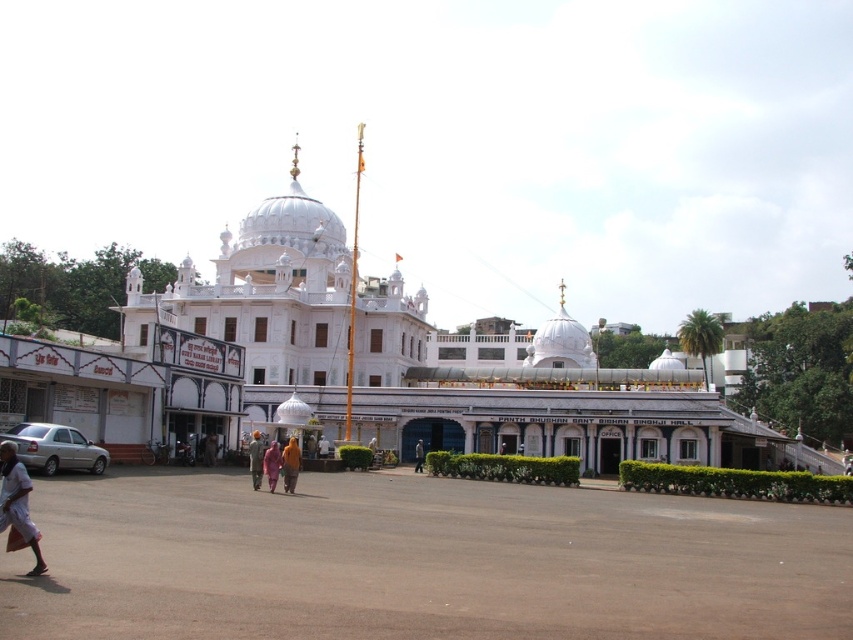
Which is behind, point (291, 488) or point (265, 461)?

The point (265, 461) is behind.

Which of these two, light pink fabric at center or orange fabric person at center, stands taller?

orange fabric person at center is taller.

What do you see at coordinates (289, 465) in the screenshot? I see `light pink fabric at center` at bounding box center [289, 465].

You are a GUI agent. You are given a task and a screenshot of the screen. Output one action in this format:
    pyautogui.click(x=<x>, y=<y>)
    Task: Click on the light pink fabric at center
    This screenshot has width=853, height=640.
    Given the screenshot: What is the action you would take?
    pyautogui.click(x=289, y=465)

The height and width of the screenshot is (640, 853). What do you see at coordinates (421, 561) in the screenshot? I see `brown asphalt plaza at lower center` at bounding box center [421, 561].

Who is more distant from viewer, (538, 628) or (271, 444)?

The point (271, 444) is more distant.

Identify the location of brown asphalt plaza at lower center. (421, 561).

Locate an element on the screen. This screenshot has height=640, width=853. brown asphalt plaza at lower center is located at coordinates (421, 561).

Can you confirm if light blue fabric at lower left is smaller than pink fabric at center?

No, light blue fabric at lower left is not smaller than pink fabric at center.

Can you confirm if light blue fabric at lower left is positioned above pink fabric at center?

Correct, light blue fabric at lower left is located above pink fabric at center.

Who is more distant from viewer, (28, 531) or (421, 440)?

The point (421, 440) is behind.

You are a GUI agent. You are given a task and a screenshot of the screen. Output one action in this format:
    pyautogui.click(x=<x>, y=<y>)
    Task: Click on the light blue fabric at lower left
    The width and height of the screenshot is (853, 640).
    Given the screenshot: What is the action you would take?
    pyautogui.click(x=16, y=506)